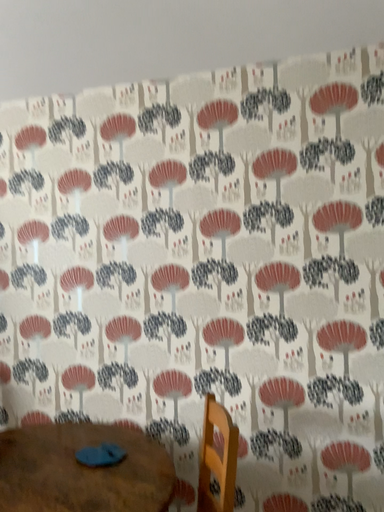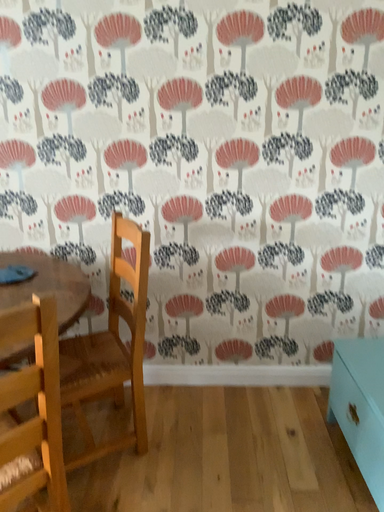
Question: How did the camera likely rotate when shooting the video?

Choices:
 (A) rotated right
 (B) rotated left

Answer: (A)